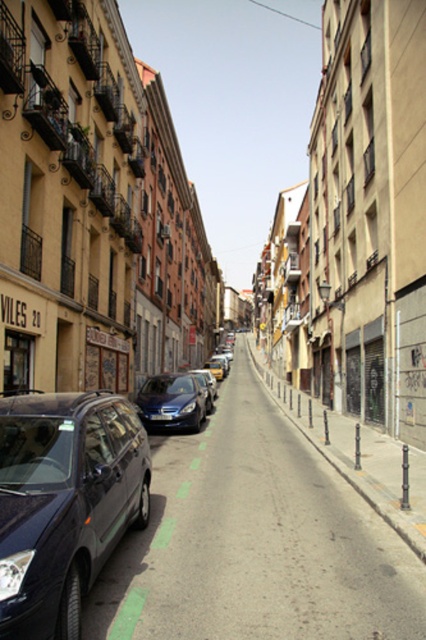
Which is behind, point (121, 627) or point (181, 388)?

The point (181, 388) is behind.

Does metallic gray car at left appear under shiny blue sedan at center?

Indeed, metallic gray car at left is positioned under shiny blue sedan at center.

Is point (368, 532) closer to camera compared to point (152, 392)?

That is True.

Find the location of `metallic gray car at left`. metallic gray car at left is located at coordinates (255, 541).

Can you confirm if metallic gray car at left is positioned above black plastic license plate at center?

Actually, metallic gray car at left is below black plastic license plate at center.

Can you confirm if metallic gray car at left is taller than black plastic license plate at center?

Yes.

Does point (394, 566) come behind point (161, 413)?

No, it is in front of (161, 413).

You are a GUI agent. You are given a task and a screenshot of the screen. Output one action in this format:
    pyautogui.click(x=<x>, y=<y>)
    Task: Click on the metallic gray car at left
    This screenshot has height=640, width=426.
    Given the screenshot: What is the action you would take?
    pyautogui.click(x=255, y=541)

Does metallic gray car at left have a lesser width compared to metallic blue minivan at left?

No, metallic gray car at left is not thinner than metallic blue minivan at left.

Which is more to the left, metallic gray car at left or metallic blue minivan at left?

Positioned to the left is metallic blue minivan at left.

Does point (328, 515) come farther from viewer compared to point (25, 419)?

Yes, point (328, 515) is behind point (25, 419).

This screenshot has height=640, width=426. In order to click on metallic gray car at left in this screenshot , I will do `click(255, 541)`.